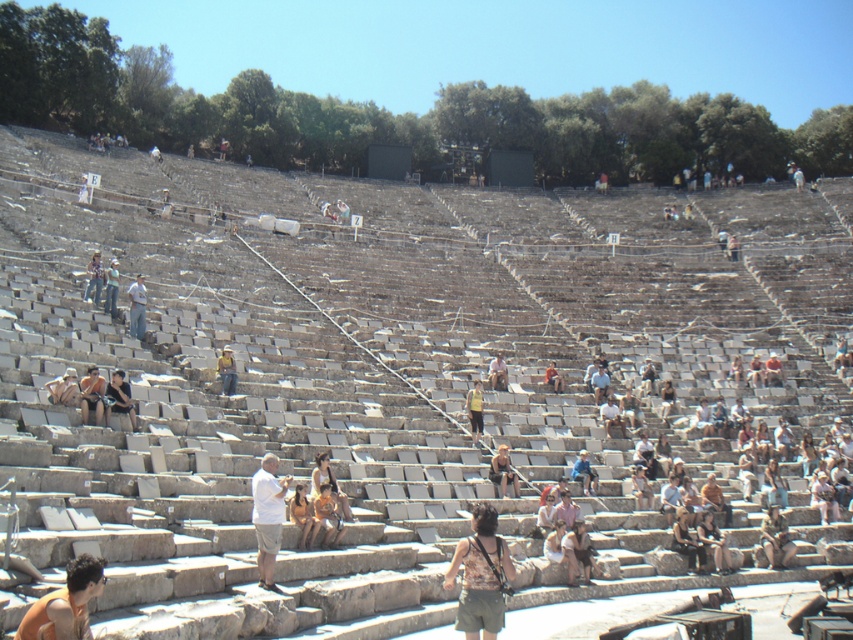
Can you confirm if light brown fabric shorts at center is taller than blue denim jeans at center?

No, light brown fabric shorts at center is not taller than blue denim jeans at center.

Is point (265, 554) more distant than point (575, 461)?

No, (265, 554) is closer to viewer.

This screenshot has height=640, width=853. What do you see at coordinates (268, 515) in the screenshot?
I see `light brown fabric shorts at center` at bounding box center [268, 515].

Find the location of a particular element. The width and height of the screenshot is (853, 640). light brown fabric shorts at center is located at coordinates (268, 515).

Does point (67, 616) lie in front of point (585, 464)?

Yes, point (67, 616) is closer to viewer.

Who is shorter, orange fabric at lower left or blue denim jeans at center?

orange fabric at lower left is shorter.

Where is `orange fabric at lower left`? The width and height of the screenshot is (853, 640). orange fabric at lower left is located at coordinates (65, 604).

Does point (471, 545) come farther from viewer compared to point (558, 387)?

That is False.

Locate an element on the screen. The image size is (853, 640). brown fabric shirt at center is located at coordinates (480, 576).